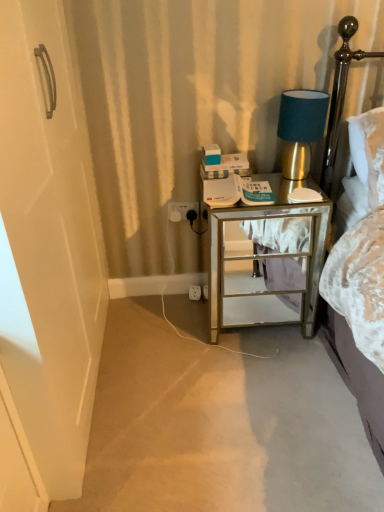
Question: Is metallic gold headboard at upper right looking in the opposite direction of white plastic electric outlet at lower center, marked as the 2th electric outlet in a top-to-bottom arrangement?

Choices:
 (A) no
 (B) yes

Answer: (A)

Question: From the image's perspective, is metallic gold headboard at upper right beneath white plastic electric outlet at lower center, which is the 1th electric outlet in back-to-front order?

Choices:
 (A) yes
 (B) no

Answer: (B)

Question: Does metallic gold headboard at upper right appear on the left side of white plastic electric outlet at lower center, which is the 1th electric outlet in back-to-front order?

Choices:
 (A) yes
 (B) no

Answer: (B)

Question: Is metallic gold headboard at upper right wider than white plastic electric outlet at lower center, arranged as the 2th electric outlet when viewed from the front?

Choices:
 (A) no
 (B) yes

Answer: (B)

Question: Considering the relative positions of metallic gold headboard at upper right and white plastic electric outlet at lower center, arranged as the 2th electric outlet when viewed from the front, in the image provided, is metallic gold headboard at upper right to the right of white plastic electric outlet at lower center, arranged as the 2th electric outlet when viewed from the front, from the viewer's perspective?

Choices:
 (A) yes
 (B) no

Answer: (A)

Question: From their relative heights in the image, would you say mirrored glass nightstand at right is taller or shorter than gold metallic table lamp at upper right?

Choices:
 (A) short
 (B) tall

Answer: (B)

Question: From a real-world perspective, is mirrored glass nightstand at right positioned above or below gold metallic table lamp at upper right?

Choices:
 (A) above
 (B) below

Answer: (B)

Question: Is mirrored glass nightstand at right inside the boundaries of gold metallic table lamp at upper right, or outside?

Choices:
 (A) inside
 (B) outside

Answer: (B)

Question: Is mirrored glass nightstand at right bigger or smaller than gold metallic table lamp at upper right?

Choices:
 (A) big
 (B) small

Answer: (A)

Question: From a real-world perspective, relative to metallic gold headboard at upper right, is white plastic electric outlet at lower center, the 1th electric outlet when ordered from top to bottom, vertically above or below?

Choices:
 (A) below
 (B) above

Answer: (A)

Question: Is white plastic electric outlet at lower center, positioned as the 1th electric outlet in front-to-back order, spatially inside metallic gold headboard at upper right, or outside of it?

Choices:
 (A) outside
 (B) inside

Answer: (A)

Question: Relative to metallic gold headboard at upper right, is white plastic electric outlet at lower center, positioned as the 2th electric outlet in bottom-to-top order, in front or behind?

Choices:
 (A) front
 (B) behind

Answer: (B)

Question: Looking at the image, does white plastic electric outlet at lower center, the second electric outlet viewed from the back, seem bigger or smaller compared to metallic gold headboard at upper right?

Choices:
 (A) big
 (B) small

Answer: (B)

Question: In the image, is white plastic electric outlet at lower center, which is counted as the 1th electric outlet, starting from the bottom, on the left side or the right side of white plastic electric outlet at lower center, positioned as the 2th electric outlet in bottom-to-top order?

Choices:
 (A) left
 (B) right

Answer: (B)

Question: Do you think white plastic electric outlet at lower center, marked as the 2th electric outlet in a top-to-bottom arrangement, is within white plastic electric outlet at lower center, positioned as the 2th electric outlet in bottom-to-top order, or outside of it?

Choices:
 (A) outside
 (B) inside

Answer: (A)